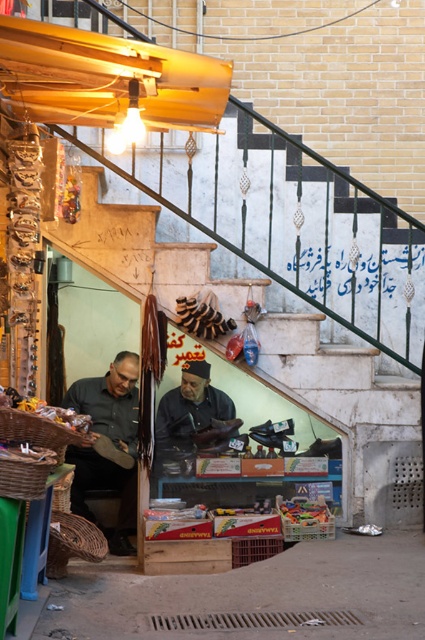
Is dark gray shirt at center to the right of metallic silver sign at center from the viewer's perspective?

No, dark gray shirt at center is not to the right of metallic silver sign at center.

Does dark gray shirt at center have a greater height compared to metallic silver sign at center?

Yes.

The height and width of the screenshot is (640, 425). What do you see at coordinates (113, 442) in the screenshot?
I see `dark gray shirt at center` at bounding box center [113, 442].

The image size is (425, 640). What are the coordinates of `dark gray shirt at center` in the screenshot? It's located at (113, 442).

Which is below, dark gray shirt at center or dark brown leather cap at center?

Positioned lower is dark gray shirt at center.

Is dark gray shirt at center smaller than dark brown leather cap at center?

Incorrect, dark gray shirt at center is not smaller in size than dark brown leather cap at center.

Image resolution: width=425 pixels, height=640 pixels. What are the coordinates of `dark gray shirt at center` in the screenshot? It's located at (113, 442).

Identify the location of dark gray shirt at center. pyautogui.click(x=113, y=442).

Who is more forward, (173, 422) or (387, 291)?

Positioned in front is point (173, 422).

Does dark brown leather cap at center have a greater height compared to metallic silver sign at center?

Indeed, dark brown leather cap at center has a greater height compared to metallic silver sign at center.

Who is more forward, [170,408] or [342,273]?

Positioned in front is point [170,408].

Locate an element on the screen. The width and height of the screenshot is (425, 640). dark brown leather cap at center is located at coordinates (195, 412).